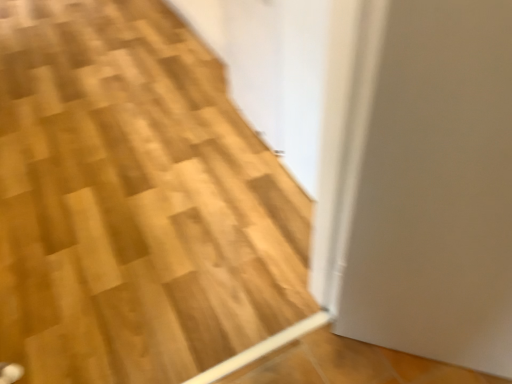
Question: Should I look upward or downward to see wooden at lower left?

Choices:
 (A) down
 (B) up

Answer: (B)